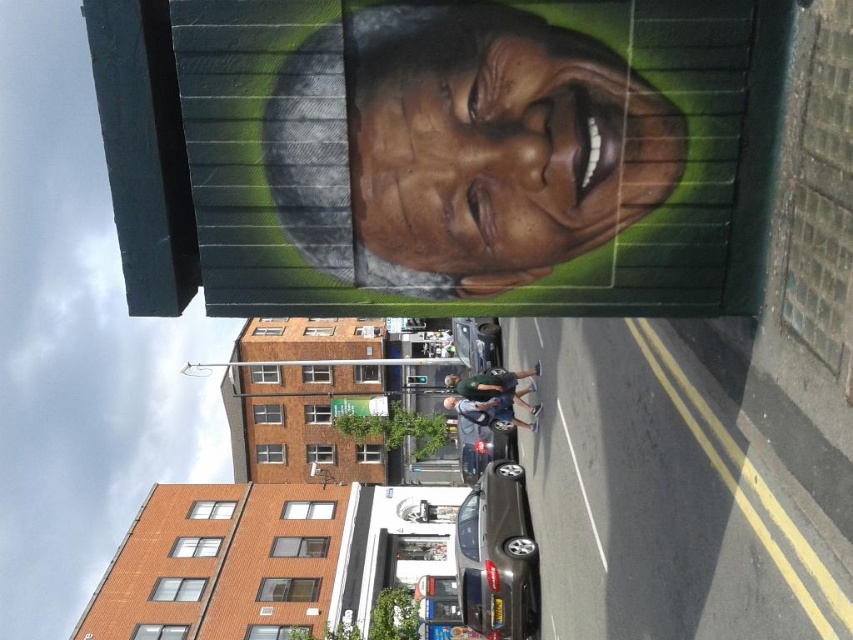
You are a delivery driver who needs to park your metallic gray sedan at center without blocking the view of the matte brown face at upper center. Is this possible given their positions?

The matte brown face at upper center is located above the metallic gray sedan at center, so parking the metallic gray sedan at center would not block the view of the matte brown face since it is positioned below it.

You are a delivery driver navigating through the urban street scene. You see two points on your GPS map labeled as point 1 and point 2. Point 1 is at coordinates point (492,426) and point 2 is at point (479,412). Which point is closer to the parked cars along the street?

Point (479,412) is closer to the parked cars along the street because it is in front of point (492,426), which is behind it.

You are a delivery person trying to park your shiny silver car at center in a spot that can also accommodate a matte black jacket at center. Is there enough space?

The shiny silver car at center is bigger than the matte black jacket at center, so there is enough space to park the shiny silver car at center and still accommodate the matte black jacket at center.